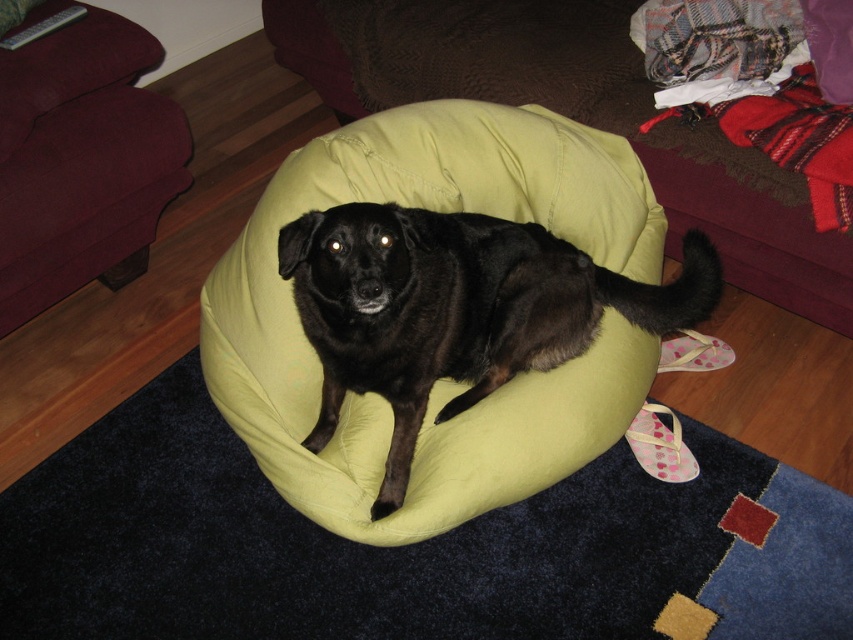
You are a guest in this living room and want to sit on the maroon fabric couch at upper left. Where should you look to find the black matte dog at center?

The black matte dog at center is located below the maroon fabric couch at upper left, so you should look downward from the couch to find it.

Based on the photo, you are a person who is 1.7 meters tall. You want to sit on the green fabric couch at center and the maroon fabric couch at upper left. Which couch will require you to bend lower to sit down?

The green fabric couch at center is much taller than the maroon fabric couch at upper left, so you will need to bend lower to sit on the green fabric couch at center.